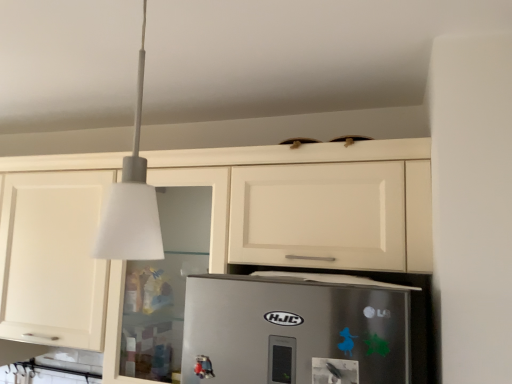
Question: From their relative heights in the image, would you say white matte lampshade at upper center is taller or shorter than white matte cabinet at upper center?

Choices:
 (A) tall
 (B) short

Answer: (B)

Question: In the image, is white matte lampshade at upper center on the left side or the right side of white matte cabinet at upper center?

Choices:
 (A) left
 (B) right

Answer: (B)

Question: Is white matte lampshade at upper center spatially inside white matte cabinet at upper center, or outside of it?

Choices:
 (A) inside
 (B) outside

Answer: (B)

Question: Considering the positions of white matte cabinet at upper center and white matte lampshade at upper center in the image, is white matte cabinet at upper center bigger or smaller than white matte lampshade at upper center?

Choices:
 (A) big
 (B) small

Answer: (A)

Question: From a real-world perspective, relative to white matte lampshade at upper center, is white matte cabinet at upper center vertically above or below?

Choices:
 (A) above
 (B) below

Answer: (B)

Question: Considering their positions, is white matte cabinet at upper center located in front of or behind white matte lampshade at upper center?

Choices:
 (A) front
 (B) behind

Answer: (B)

Question: Considering the relative positions of white matte cabinet at upper center and white matte lampshade at upper center in the image provided, is white matte cabinet at upper center to the left or to the right of white matte lampshade at upper center?

Choices:
 (A) right
 (B) left

Answer: (B)